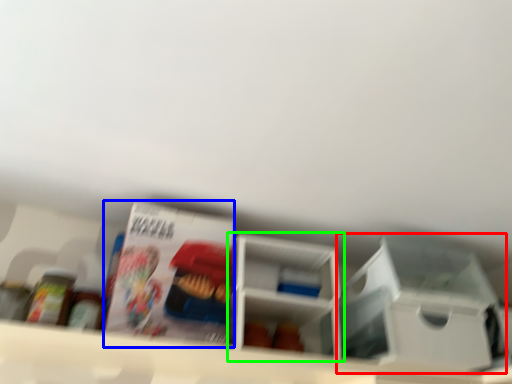
Question: Which is farther away from storage box (highlighted by a red box)? magazine (highlighted by a blue box) or shelf (highlighted by a green box)?

Choices:
 (A) magazine
 (B) shelf

Answer: (A)